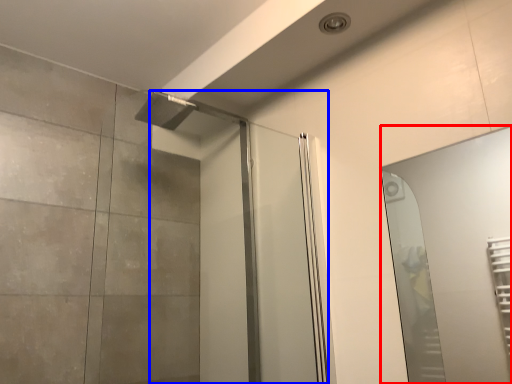
Question: Among these objects, which one is nearest to the camera, mirror (highlighted by a red box) or screen door (highlighted by a blue box)?

Choices:
 (A) mirror
 (B) screen door

Answer: (A)